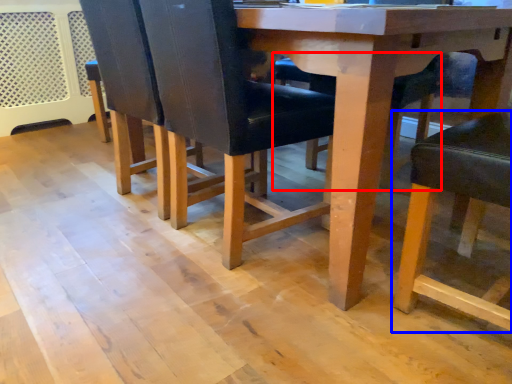
Question: Which object is further to the camera taking this photo, chair (highlighted by a red box) or chair (highlighted by a blue box)?

Choices:
 (A) chair
 (B) chair

Answer: (A)